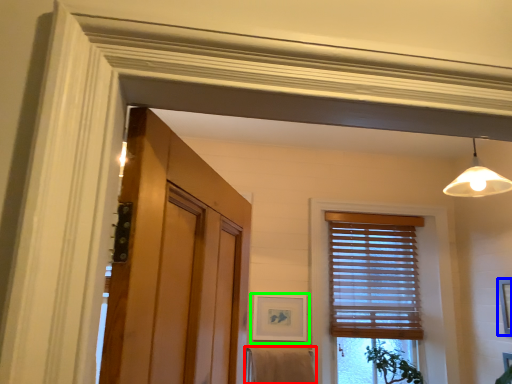
Question: Estimate the real-world distances between objects in this image. Which object is farther from bath towel (highlighted by a red box), picture frame (highlighted by a blue box) or picture frame (highlighted by a green box)?

Choices:
 (A) picture frame
 (B) picture frame

Answer: (A)